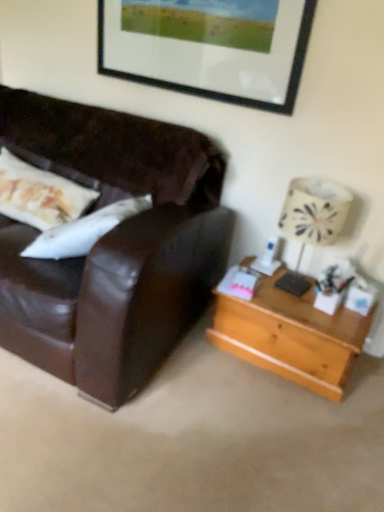
Question: Is point (221, 60) closer or farther from the camera than point (281, 373)?

Choices:
 (A) closer
 (B) farther

Answer: (B)

Question: Relative to light brown wooden table at right, is black matte picture frame at upper center in front or behind?

Choices:
 (A) behind
 (B) front

Answer: (A)

Question: Estimate the real-world distances between objects in this image. Which object is farther from the light brown wooden table at right?

Choices:
 (A) black matte picture frame at upper center
 (B) white fabric lampshade at right

Answer: (A)

Question: Estimate the real-world distances between objects in this image. Which object is farther from the light brown wooden table at right?

Choices:
 (A) black matte picture frame at upper center
 (B) white fabric lampshade at right

Answer: (A)